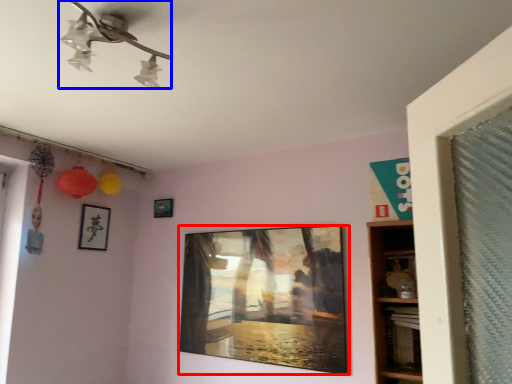
Question: Which of the following is the closest to the observer, picture frame (highlighted by a red box) or lamp (highlighted by a blue box)?

Choices:
 (A) picture frame
 (B) lamp

Answer: (B)